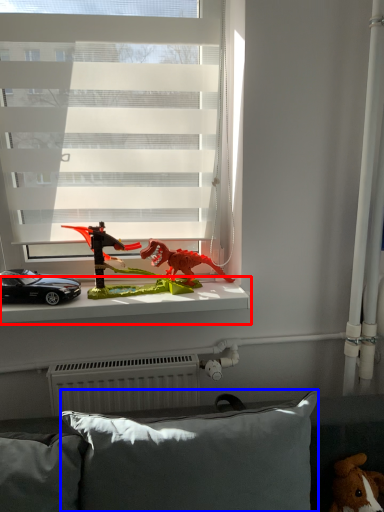
Question: Which of the following is the closest to the observer, window sill (highlighted by a red box) or pillow (highlighted by a blue box)?

Choices:
 (A) window sill
 (B) pillow

Answer: (B)